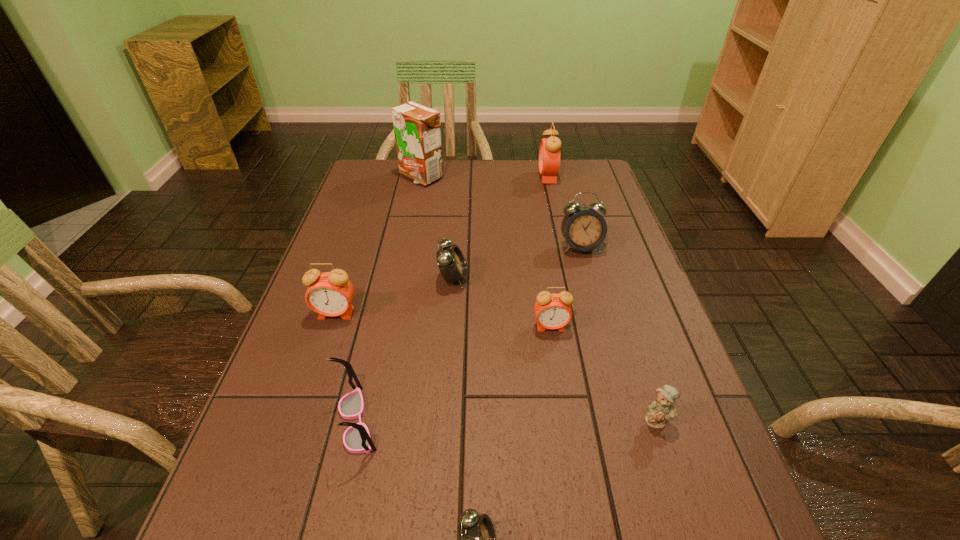
Locate an element on the screen. This screenshot has height=540, width=960. the second pink alarm clock from right to left is located at coordinates (553, 311).

Where is `pink spectacles`? pink spectacles is located at coordinates (357, 439).

Identify the location of blue teddy bear. The width and height of the screenshot is (960, 540). (660, 410).

Where is `free spot located 0.140m on the straw side of the tallest object`? The width and height of the screenshot is (960, 540). free spot located 0.140m on the straw side of the tallest object is located at coordinates (414, 212).

This screenshot has height=540, width=960. I want to click on vacant space located 0.370m on the face of the farthest pink alarm clock, so click(x=430, y=177).

This screenshot has height=540, width=960. Identify the location of free space located on the face of the farthest pink alarm clock. (424, 177).

Locate an element on the screen. The width and height of the screenshot is (960, 540). vacant region located 0.360m on the face of the farthest pink alarm clock is located at coordinates (433, 177).

The height and width of the screenshot is (540, 960). Identify the location of free space located 0.320m on the face of the rightmost white alarm clock. (610, 353).

Find the location of `vacant space located 0.050m on the face of the leftmost pink alarm clock`. vacant space located 0.050m on the face of the leftmost pink alarm clock is located at coordinates (327, 338).

This screenshot has height=540, width=960. What are the coordinates of `free space located 0.350m on the face of the fourth nearest alarm clock` in the screenshot? It's located at (607, 279).